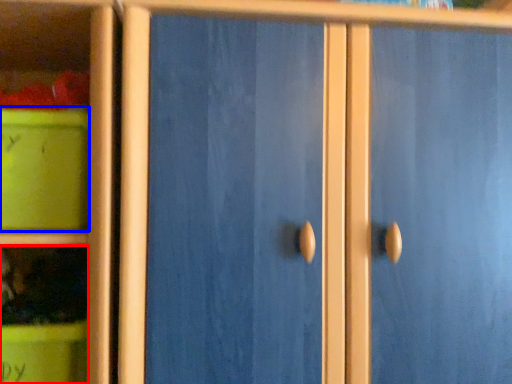
Question: Among these objects, which one is farthest to the camera, cabinet (highlighted by a red box) or storage box (highlighted by a blue box)?

Choices:
 (A) cabinet
 (B) storage box

Answer: (A)